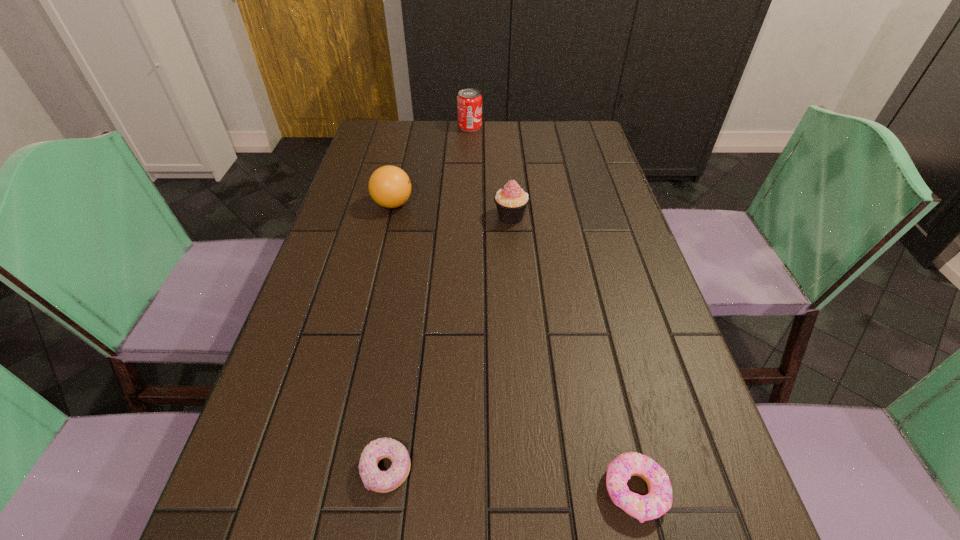
Point out which object is positioned as the third nearest to the cupcake. Please provide its 2D coordinates. Your answer should be formatted as a tuple, i.e. [(x, y)], where the tuple contains the x and y coordinates of a point satisfying the conditions above.

[(373, 479)]

The height and width of the screenshot is (540, 960). What are the coordinates of `vacant space that satisfies the following two spatial constraints: 1. on the back side of the left doughnut; 2. on the side with brand of the ping-pong ball` in the screenshot? It's located at click(425, 204).

The width and height of the screenshot is (960, 540). Identify the location of vacant space that satisfies the following two spatial constraints: 1. on the back side of the left doughnut; 2. on the right side of the cupcake. (423, 217).

Find the location of `free point that satisfies the following two spatial constraints: 1. on the side with brand of the ping-pong ball; 2. on the back side of the second object from right to left`. free point that satisfies the following two spatial constraints: 1. on the side with brand of the ping-pong ball; 2. on the back side of the second object from right to left is located at coordinates (390, 217).

Identify the location of blank space that satisfies the following two spatial constraints: 1. on the side with brand of the ping-pong ball; 2. on the back side of the left doughnut. This screenshot has width=960, height=540. 330,470.

At what (x,y) coordinates should I click in order to perform the action: click on blank space that satisfies the following two spatial constraints: 1. on the back side of the left doughnut; 2. on the side with brand of the ping-pong ball. Please return your answer as a coordinate pair (x, y). The width and height of the screenshot is (960, 540). Looking at the image, I should click on (425, 204).